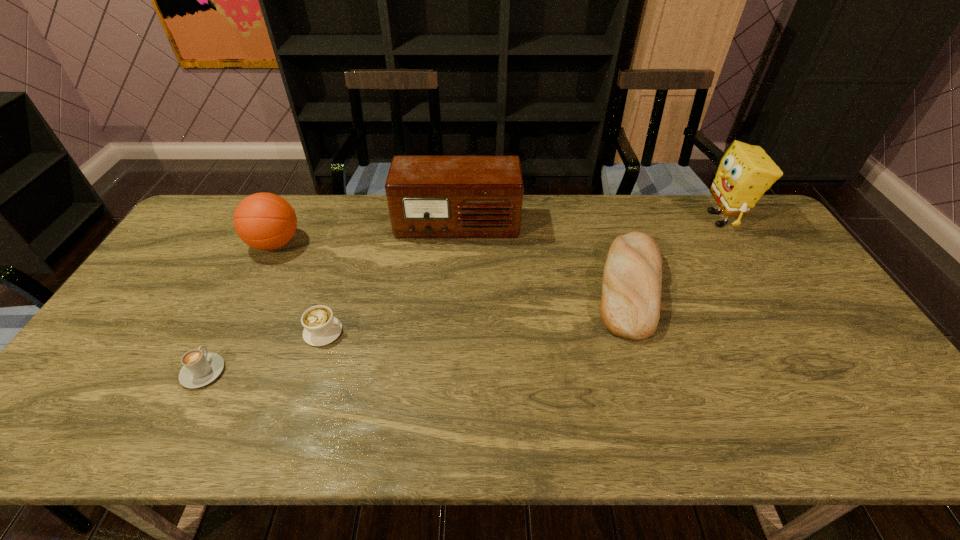
I want to click on the nearer cappuccino, so click(x=199, y=369).

Identify the location of free spot located 0.140m on the face of the rightmost object. (660, 219).

Image resolution: width=960 pixels, height=540 pixels. What are the coordinates of `vacant space located 0.280m on the face of the rightmost object` in the screenshot? It's located at (618, 219).

This screenshot has width=960, height=540. In order to click on free point located 0.250m on the face of the rightmost object in this screenshot , I will do `click(627, 219)`.

Identify the location of vacant space situated on the front-facing side of the radio receiver. The image size is (960, 540). (454, 274).

This screenshot has height=540, width=960. I want to click on free spot located on the back of the basketball, so click(x=291, y=212).

Where is `free space located 0.220m on the left of the second object from right to left`? The image size is (960, 540). free space located 0.220m on the left of the second object from right to left is located at coordinates (516, 286).

Identify the location of blank area located 0.150m to the right of the right cappuccino's handle. coord(400,332).

Locate an element on the screen. This screenshot has height=540, width=960. vacant space positioned to the right of the nearest object is located at coordinates (258, 265).

Locate an element on the screen. vacant space situated 0.260m to the right of the nearest object is located at coordinates (250, 281).